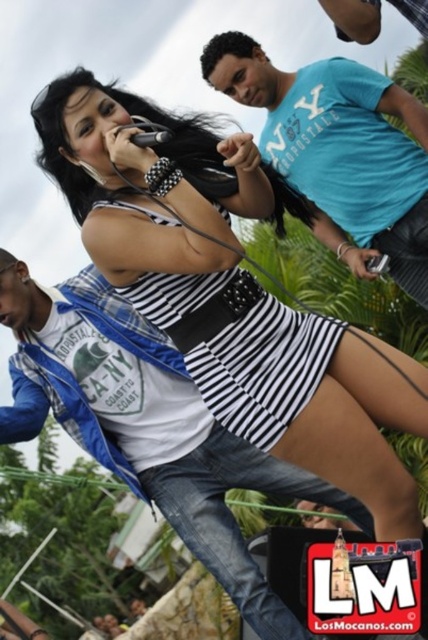
Question: Can you confirm if teal cotton t-shirt at upper center is positioned to the left of black and white striped dress at center?

Choices:
 (A) no
 (B) yes

Answer: (A)

Question: Does teal cotton t-shirt at upper center have a larger size compared to black and white striped dress at center?

Choices:
 (A) yes
 (B) no

Answer: (A)

Question: Which point is farther from the camera taking this photo?

Choices:
 (A) (416, 275)
 (B) (151, 301)

Answer: (A)

Question: Does teal cotton t-shirt at upper center appear under black and white striped dress at center?

Choices:
 (A) yes
 (B) no

Answer: (B)

Question: Which of the following is the closest to the observer?

Choices:
 (A) (205, 45)
 (B) (255, 344)

Answer: (B)